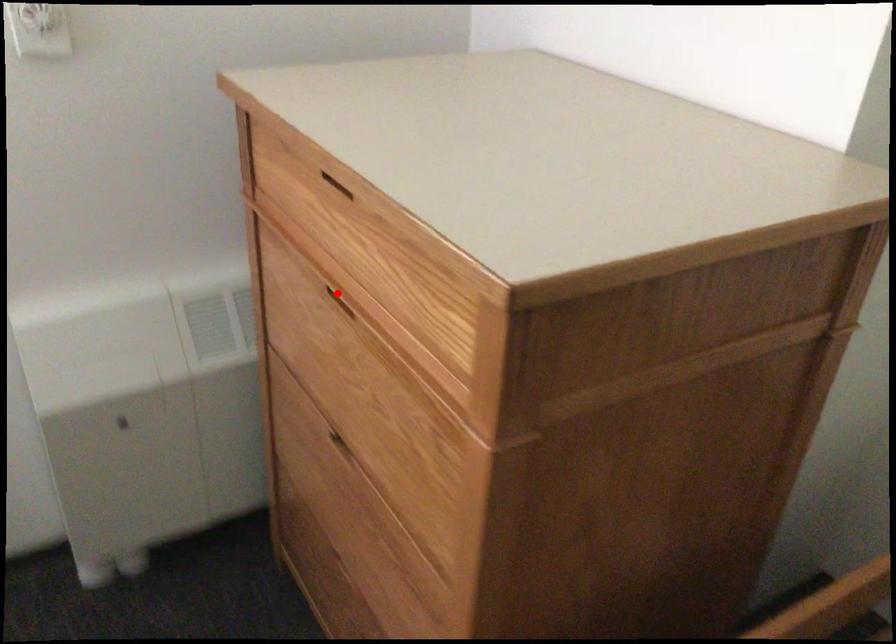
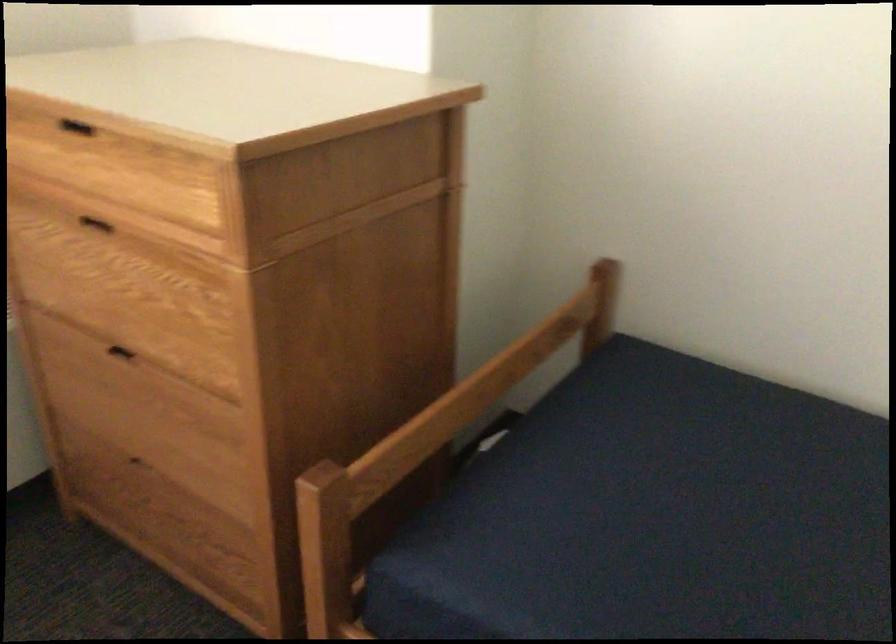
In the second image, find the point that corresponds to the highlighted location in the first image.

(96, 223)